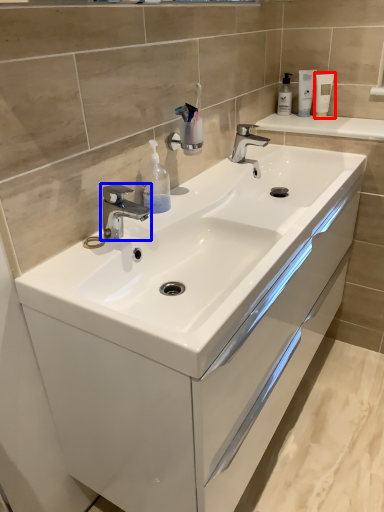
Question: Which point is closer to the camera, mouthwash (highlighted by a red box) or tap (highlighted by a blue box)?

Choices:
 (A) mouthwash
 (B) tap

Answer: (B)